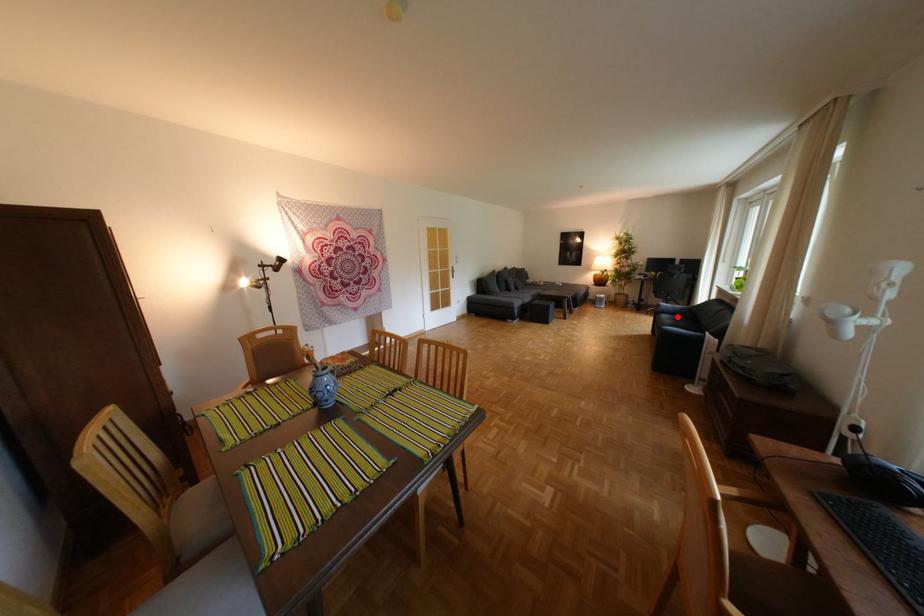
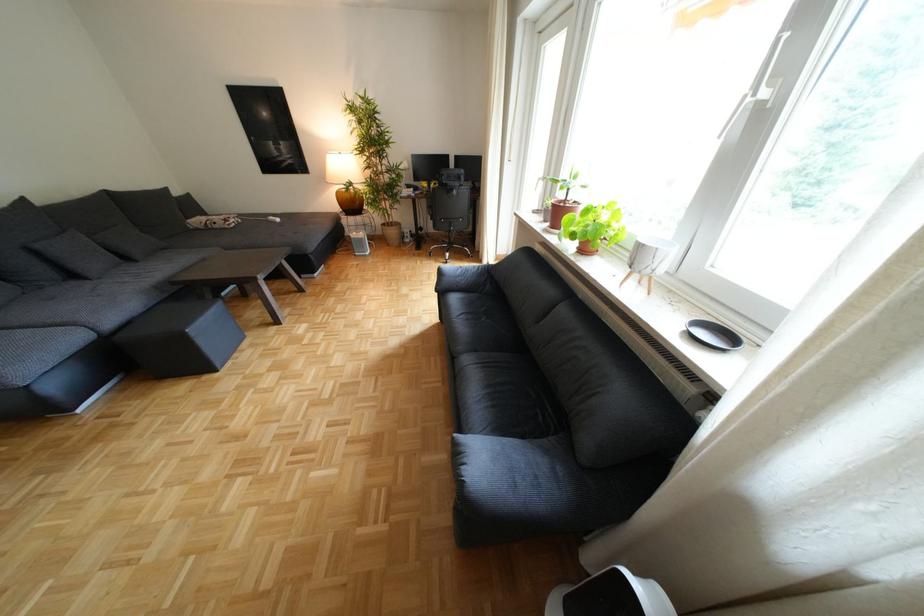
Locate, in the second image, the point that corresponds to the highlighted location in the first image.

(467, 299)